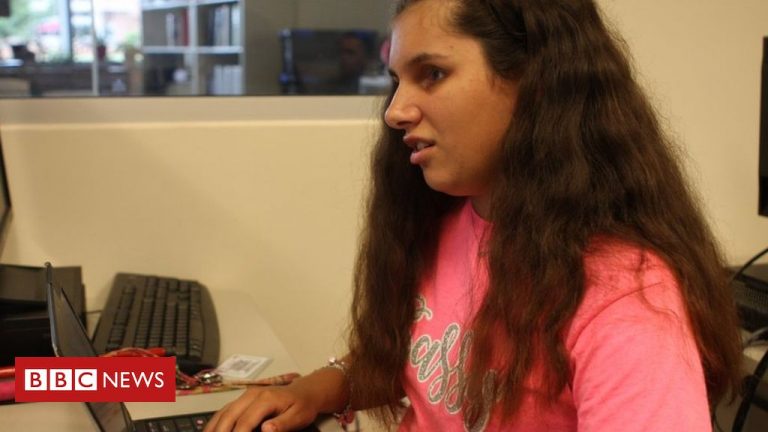
Where is `window`? This screenshot has width=768, height=432. window is located at coordinates coord(40,21).